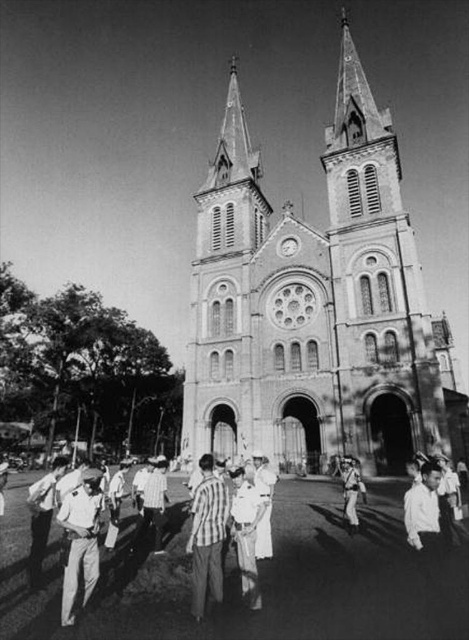
Question: Which of the following is the closest to the observer?

Choices:
 (A) checkered fabric shirt at center
 (B) stone church at center
 (C) light brown fabric pants at lower left

Answer: (C)

Question: Is stone church at center to the right of light brown leather jacket at lower left from the viewer's perspective?

Choices:
 (A) no
 (B) yes

Answer: (B)

Question: Does stone church at center lie behind light brown leather jacket at lower left?

Choices:
 (A) no
 (B) yes

Answer: (B)

Question: Based on their relative distances, which object is farther from the stone church at center?

Choices:
 (A) checkered fabric shirt at center
 (B) light brown leather jacket at lower left

Answer: (B)

Question: Is checkered fabric shirt at center wider than light brown leather jacket at lower left?

Choices:
 (A) no
 (B) yes

Answer: (A)

Question: Which point appears farthest from the camera in this image?

Choices:
 (A) (32, 556)
 (B) (401, 380)
 (C) (191, 516)

Answer: (B)